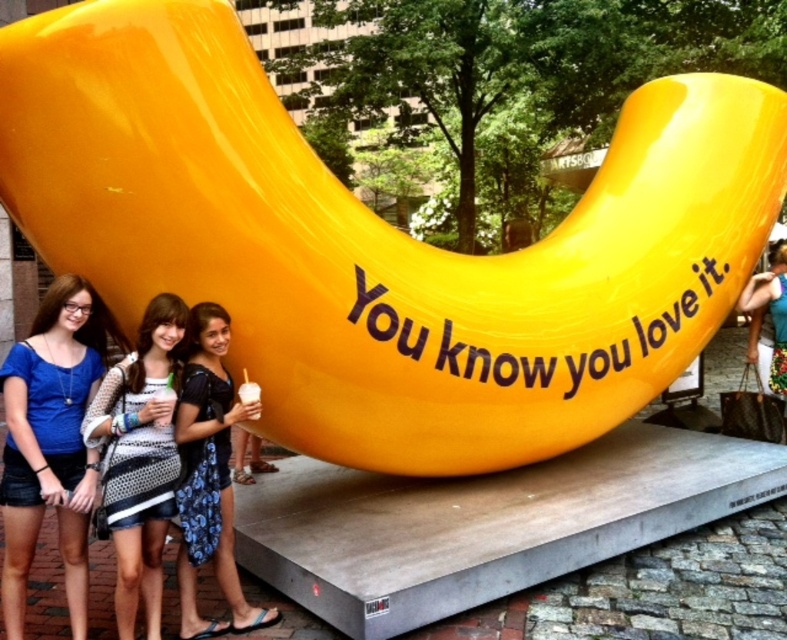
Question: Which object is positioned farthest from the matte black dress at center?

Choices:
 (A) white dotted dress at center
 (B) matte blue shirt at center
 (C) printed fabric purse at right

Answer: (C)

Question: Considering the real-world distances, which object is farthest from the white dotted dress at center?

Choices:
 (A) matte black dress at center
 (B) matte blue shirt at center
 (C) printed fabric purse at right

Answer: (C)

Question: Can you confirm if matte blue shirt at center is positioned to the right of printed fabric purse at right?

Choices:
 (A) yes
 (B) no

Answer: (B)

Question: Which object is farther from the camera taking this photo?

Choices:
 (A) matte black dress at center
 (B) matte blue shirt at center
 (C) white dotted dress at center

Answer: (A)

Question: Can you confirm if matte blue shirt at center is thinner than white dotted dress at center?

Choices:
 (A) no
 (B) yes

Answer: (A)

Question: Is matte blue shirt at center smaller than matte black dress at center?

Choices:
 (A) yes
 (B) no

Answer: (B)